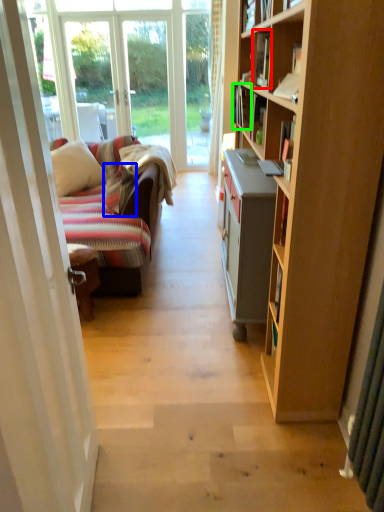
Question: Which object is positioned closest to book (highlighted by a red box)? Select from pillow (highlighted by a blue box) and book (highlighted by a green box).

Choices:
 (A) pillow
 (B) book

Answer: (B)